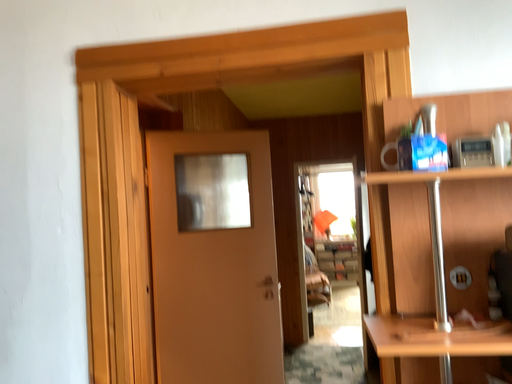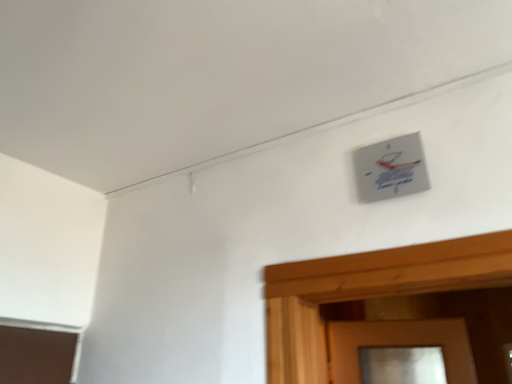
Question: How did the camera likely rotate when shooting the video?

Choices:
 (A) rotated left
 (B) rotated right

Answer: (A)